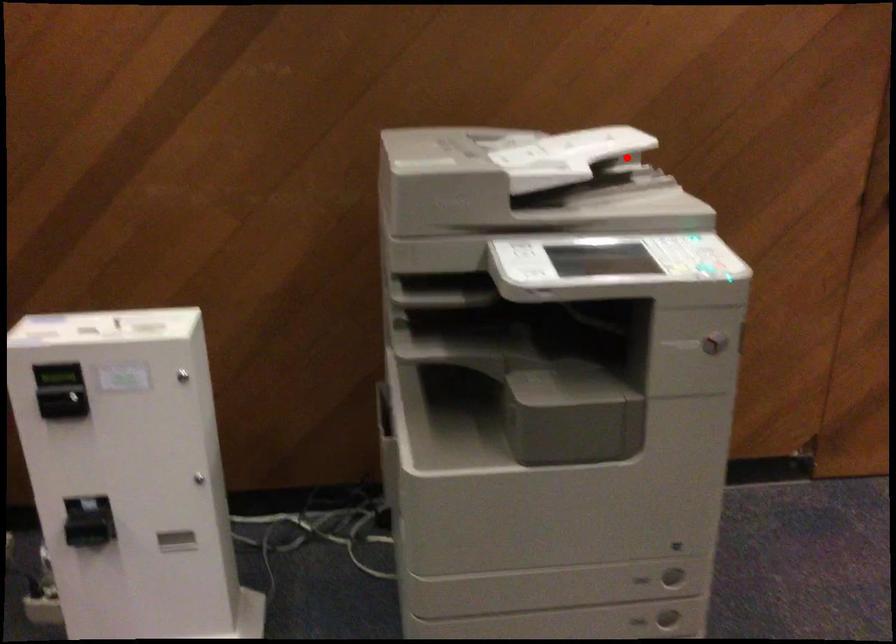
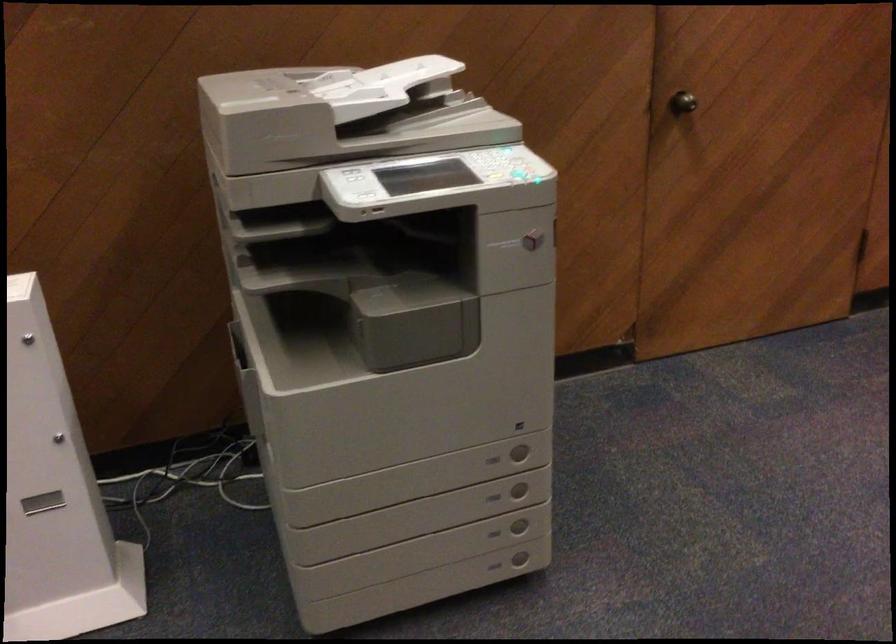
Locate, in the second image, the point that corresponds to the highlighted location in the first image.

(437, 86)